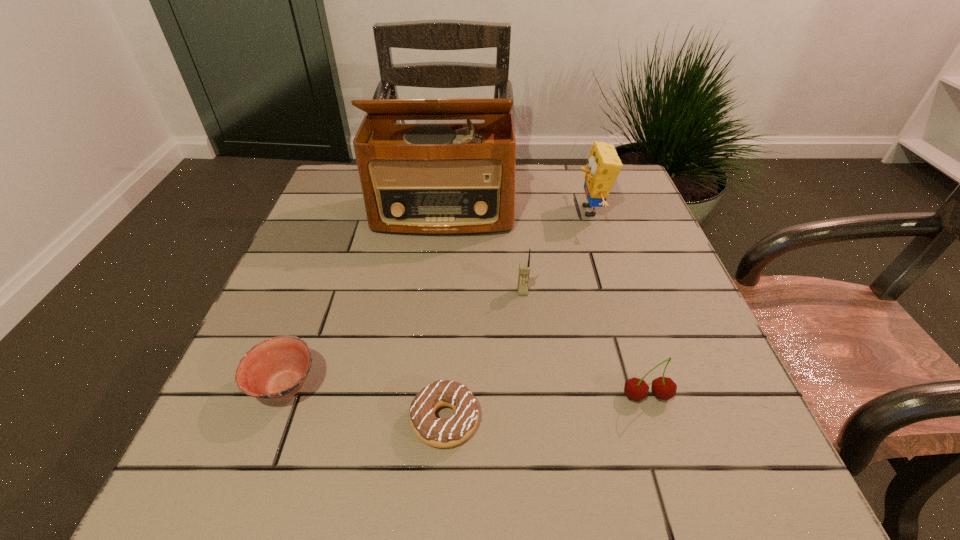
Where is `the tallest object`? The width and height of the screenshot is (960, 540). the tallest object is located at coordinates (439, 179).

Find the location of `the fifth shortest object`. the fifth shortest object is located at coordinates (604, 165).

Where is `cellular telephone`? cellular telephone is located at coordinates (524, 268).

You are a GUI agent. You are given a task and a screenshot of the screen. Output one action in this format:
    pyautogui.click(x=<x>, y=<y>)
    Task: Click on the cherry
    The height and width of the screenshot is (540, 960).
    Given the screenshot: What is the action you would take?
    pyautogui.click(x=664, y=388)

The image size is (960, 540). I want to click on the second shortest object, so click(x=276, y=369).

The height and width of the screenshot is (540, 960). I want to click on bowl, so click(276, 369).

Locate an element on the screen. The image size is (960, 540). doughnut is located at coordinates (442, 433).

Locate an element on the screen. The height and width of the screenshot is (540, 960). vacant region located on the front panel of the tallest object is located at coordinates (435, 295).

Where is `vacant point located on the face of the sponge`? vacant point located on the face of the sponge is located at coordinates (461, 211).

Locate an element on the screen. vacant space located 0.280m on the face of the sponge is located at coordinates (468, 211).